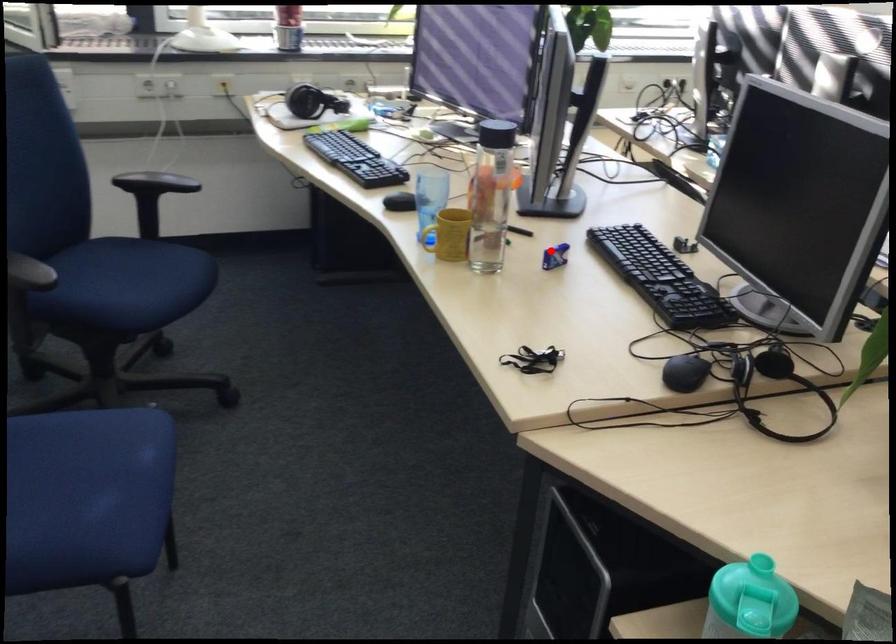
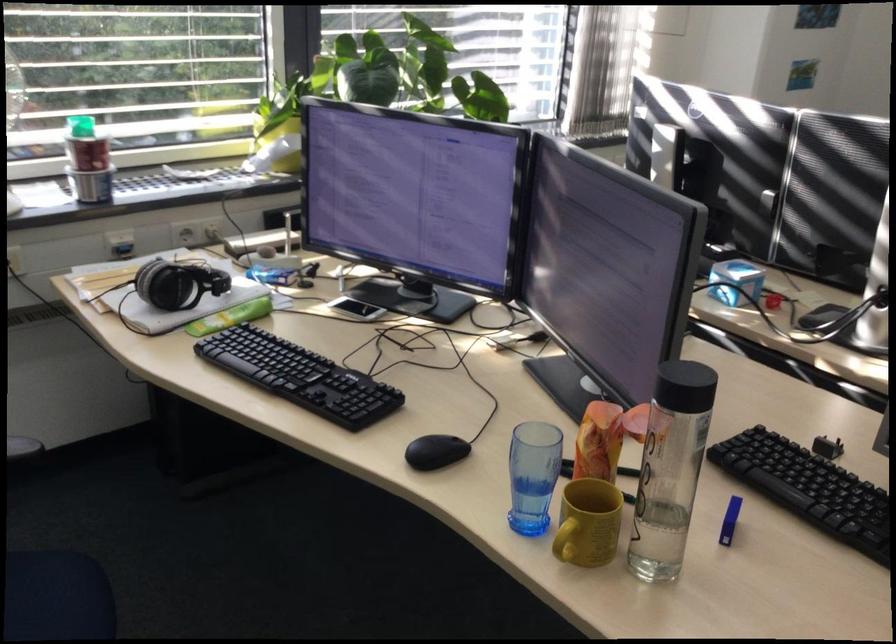
Question: I am providing you with two images of the same scene from different viewpoints. Given a red point in image1, look at the same physical point in image2. Is it:

Choices:
 (A) Closer to the viewpoint
 (B) Farther from the viewpoint

Answer: (A)